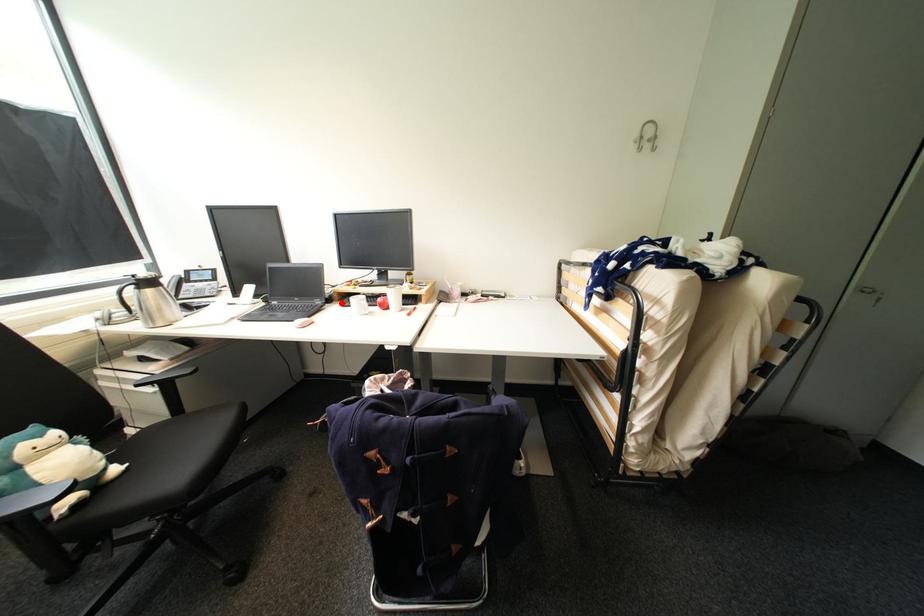
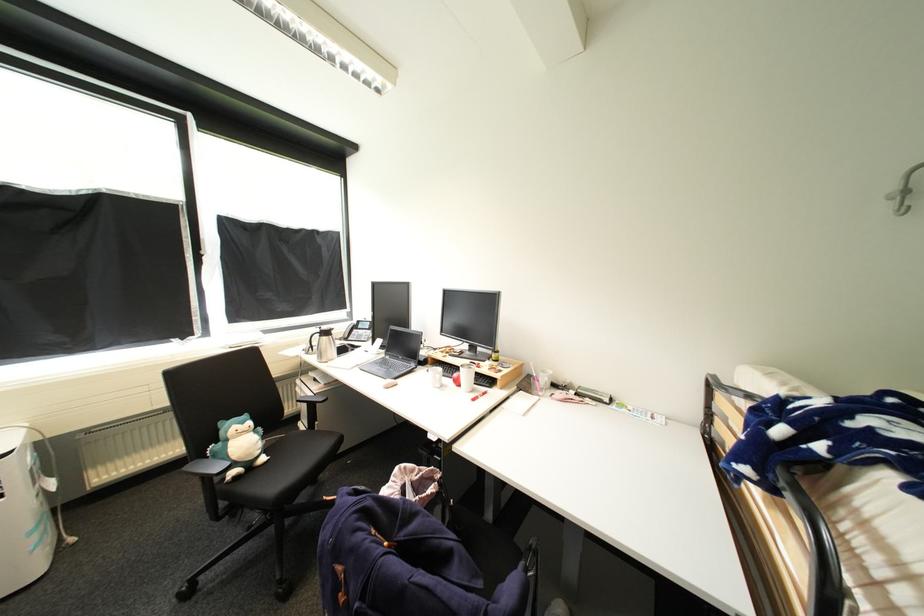
Where in the second image is the point corresponding to the highlighted location from the first image?

(434, 366)